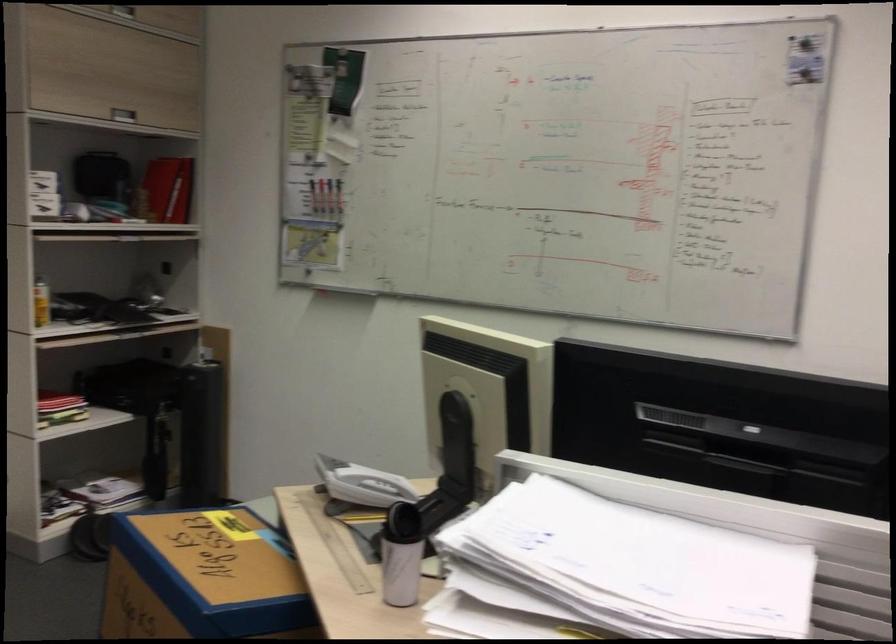
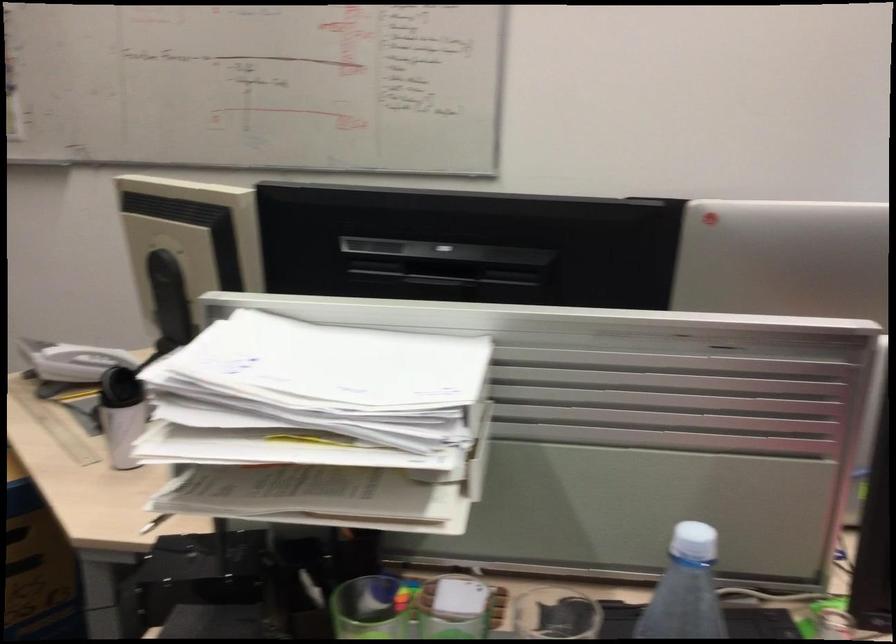
Locate, in the second image, the point that corresponds to pixel 362 482 in the first image.

(82, 362)